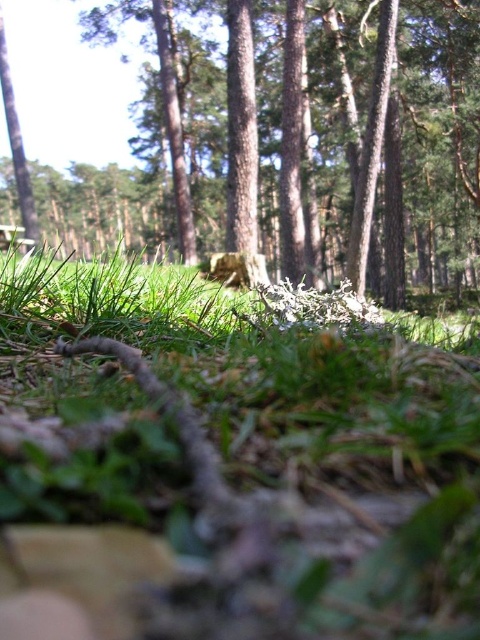
Question: Which point appears farthest from the camera in this image?

Choices:
 (A) (203, 10)
 (B) (226, 378)

Answer: (A)

Question: Observing the image, what is the correct spatial positioning of green grass at center in reference to rough bark tree at center?

Choices:
 (A) above
 (B) below

Answer: (B)

Question: Which point is farther to the camera?

Choices:
 (A) green grass at center
 (B) rough bark tree at center

Answer: (B)

Question: Does green grass at center appear on the right side of rough bark tree at center?

Choices:
 (A) yes
 (B) no

Answer: (A)

Question: Is green grass at center to the left of rough bark tree at center from the viewer's perspective?

Choices:
 (A) yes
 (B) no

Answer: (B)